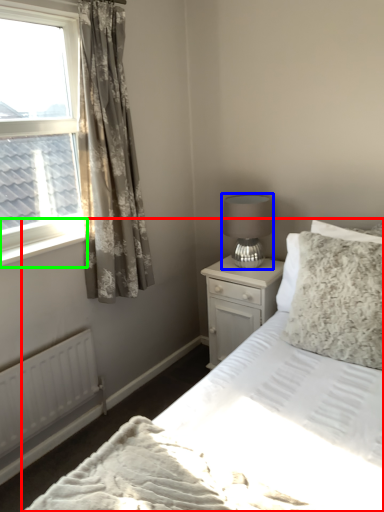
Question: Based on their relative distances, which object is nearer to bed (highlighted by a red box)? Choose from table lamp (highlighted by a blue box) and window sill (highlighted by a green box).

Choices:
 (A) table lamp
 (B) window sill

Answer: (A)